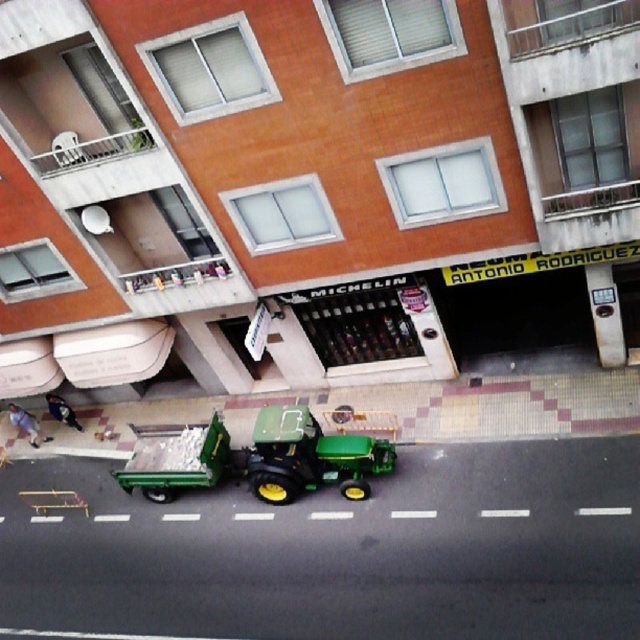
You are a delivery person who needs to park your van near the green rubber tractor at center and the dark blue jeans at lower left. Which parking spot would be more appropriate for your van?

The green rubber tractor at center is larger than the dark blue jeans at lower left, so the parking spot near the green rubber tractor at center would be more appropriate for your van.

You are a delivery person trying to reach the door of the building with the banner. You see the green rubber tractor at center and dark blue jeans at lower left. Which object is closer to the door?

The green rubber tractor at center is closer to the door because it is positioned below the dark blue jeans at lower left, which places it lower in the scene and likely nearer to the entrance.